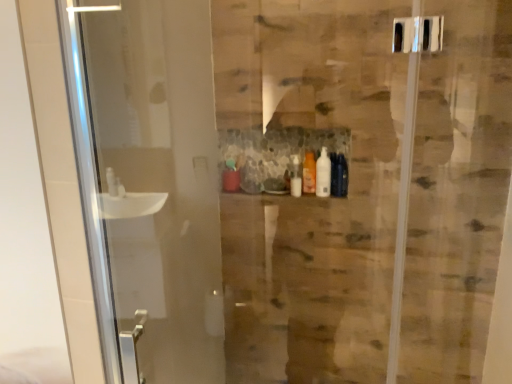
Question: In which direction should I rotate to look at matte green bottle at center, positioned as the 1th toiletry in left-to-right order?

Choices:
 (A) left
 (B) right

Answer: (A)

Question: Considering the relative sizes of matte green bottle at center, the second toiletry in the right-to-left sequence, and translucent orange bottle at center, which ranks as the 2th toiletry in left-to-right order, in the image provided, is matte green bottle at center, the second toiletry in the right-to-left sequence, thinner than translucent orange bottle at center, which ranks as the 2th toiletry in left-to-right order,?

Choices:
 (A) no
 (B) yes

Answer: (A)

Question: Is matte green bottle at center, positioned as the 1th toiletry in left-to-right order, far from translucent orange bottle at center, which ranks as the 2th toiletry in left-to-right order?

Choices:
 (A) no
 (B) yes

Answer: (A)

Question: Considering the relative sizes of matte green bottle at center, positioned as the 1th toiletry in left-to-right order, and translucent orange bottle at center, which ranks as the 2th toiletry in left-to-right order, in the image provided, is matte green bottle at center, positioned as the 1th toiletry in left-to-right order, taller than translucent orange bottle at center, which ranks as the 2th toiletry in left-to-right order,?

Choices:
 (A) no
 (B) yes

Answer: (A)

Question: Is matte green bottle at center, the second toiletry in the right-to-left sequence, facing towards translucent orange bottle at center, which ranks as the 2th toiletry in left-to-right order?

Choices:
 (A) yes
 (B) no

Answer: (B)

Question: Considering the relative sizes of matte green bottle at center, positioned as the 1th toiletry in left-to-right order, and translucent orange bottle at center, which ranks as the 2th toiletry in left-to-right order, in the image provided, is matte green bottle at center, positioned as the 1th toiletry in left-to-right order, shorter than translucent orange bottle at center, which ranks as the 2th toiletry in left-to-right order,?

Choices:
 (A) yes
 (B) no

Answer: (A)

Question: Does matte green bottle at center, the second toiletry in the right-to-left sequence, have a greater width compared to translucent orange bottle at center, the first toiletry in the right-to-left sequence?

Choices:
 (A) yes
 (B) no

Answer: (A)

Question: Is translucent orange bottle at center, which ranks as the 2th toiletry in left-to-right order, to the right of matte green bottle at center, positioned as the 1th toiletry in left-to-right order, from the viewer's perspective?

Choices:
 (A) no
 (B) yes

Answer: (B)

Question: From a real-world perspective, is translucent orange bottle at center, which ranks as the 2th toiletry in left-to-right order, beneath matte green bottle at center, the second toiletry in the right-to-left sequence?

Choices:
 (A) no
 (B) yes

Answer: (A)

Question: From the image's perspective, is translucent orange bottle at center, the first toiletry in the right-to-left sequence, above matte green bottle at center, positioned as the 1th toiletry in left-to-right order?

Choices:
 (A) no
 (B) yes

Answer: (B)

Question: Could you tell me if translucent orange bottle at center, which ranks as the 2th toiletry in left-to-right order, is facing matte green bottle at center, the second toiletry in the right-to-left sequence?

Choices:
 (A) yes
 (B) no

Answer: (B)

Question: Does translucent orange bottle at center, the first toiletry in the right-to-left sequence, lie in front of matte green bottle at center, positioned as the 1th toiletry in left-to-right order?

Choices:
 (A) yes
 (B) no

Answer: (A)

Question: Considering the relative sizes of translucent orange bottle at center, which ranks as the 2th toiletry in left-to-right order, and matte green bottle at center, positioned as the 1th toiletry in left-to-right order, in the image provided, is translucent orange bottle at center, which ranks as the 2th toiletry in left-to-right order, thinner than matte green bottle at center, positioned as the 1th toiletry in left-to-right order,?

Choices:
 (A) no
 (B) yes

Answer: (B)

Question: Is matte green bottle at center, positioned as the 1th toiletry in left-to-right order, to the left or to the right of translucent orange bottle at center, which ranks as the 2th toiletry in left-to-right order, in the image?

Choices:
 (A) left
 (B) right

Answer: (A)